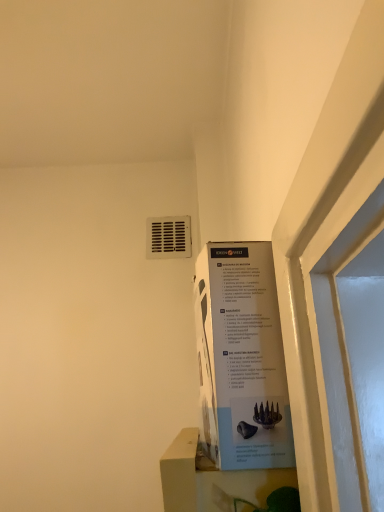
This screenshot has width=384, height=512. Describe the element at coordinates (212, 479) in the screenshot. I see `white matte window sill at lower center` at that location.

Describe the element at coordinates (242, 358) in the screenshot. I see `white cardboard poster at upper right` at that location.

You are a GUI agent. You are given a task and a screenshot of the screen. Output one action in this format:
    pyautogui.click(x=<x>, y=<y>)
    Task: Click on the white matte window sill at lower center
    Image resolution: width=384 pixels, height=512 pixels.
    Given the screenshot: What is the action you would take?
    pyautogui.click(x=212, y=479)

Which is behind, point (263, 356) or point (151, 246)?

The point (151, 246) is more distant.

Considering the relative sizes of white cardboard poster at upper right and white plastic vent at upper center in the image provided, is white cardboard poster at upper right smaller than white plastic vent at upper center?

No, white cardboard poster at upper right is not smaller than white plastic vent at upper center.

From the image's perspective, does white cardboard poster at upper right appear lower than white plastic vent at upper center?

Indeed, from the image's perspective, white cardboard poster at upper right is shown beneath white plastic vent at upper center.

Is white cardboard poster at upper right positioned with its back to white plastic vent at upper center?

That's not correct — white cardboard poster at upper right is not looking away from white plastic vent at upper center.

Can you confirm if white matte window sill at lower center is taller than white plastic vent at upper center?

Indeed, white matte window sill at lower center has a greater height compared to white plastic vent at upper center.

The height and width of the screenshot is (512, 384). In order to click on window sill in front of the white plastic vent at upper center in this screenshot , I will do `click(212, 479)`.

Which is in front, white matte window sill at lower center or white plastic vent at upper center?

white matte window sill at lower center.

Would you say white cardboard poster at upper right is inside or outside white matte window sill at lower center?

white cardboard poster at upper right cannot be found inside white matte window sill at lower center.

Could you tell me if white cardboard poster at upper right is facing white matte window sill at lower center?

Result: No, white cardboard poster at upper right is not aimed at white matte window sill at lower center.

From the picture: Looking at their sizes, would you say white cardboard poster at upper right is wider or thinner than white matte window sill at lower center?

white cardboard poster at upper right is thinner than white matte window sill at lower center.

This screenshot has height=512, width=384. What are the coordinates of `window sill in front of the white cardboard poster at upper right` in the screenshot? It's located at (212, 479).

How many degrees apart are the facing directions of white plastic vent at upper center and white matte window sill at lower center?

91.3 degrees.

In terms of size, does white plastic vent at upper center appear bigger or smaller than white matte window sill at lower center?

white plastic vent at upper center is smaller than white matte window sill at lower center.

Is white plastic vent at upper center located outside white matte window sill at lower center?

Indeed, white plastic vent at upper center is completely outside white matte window sill at lower center.

From a real-world perspective, is white plastic vent at upper center located higher than white cardboard poster at upper right?

Yes, from a real-world perspective, white plastic vent at upper center is over white cardboard poster at upper right

Considering the positions of objects white plastic vent at upper center and white cardboard poster at upper right in the image provided, who is more to the right, white plastic vent at upper center or white cardboard poster at upper right?

white cardboard poster at upper right.

Does white plastic vent at upper center have a greater height compared to white cardboard poster at upper right?

No.

Is white plastic vent at upper center further to camera compared to white cardboard poster at upper right?

Yes, white plastic vent at upper center is further from the camera.

Based on the photo, is white cardboard poster at upper right completely or partially inside white matte window sill at lower center?

No.

From their relative heights in the image, would you say white matte window sill at lower center is taller or shorter than white cardboard poster at upper right?

white matte window sill at lower center is shorter than white cardboard poster at upper right.

Is white matte window sill at lower center oriented away from white cardboard poster at upper right?

No, white matte window sill at lower center is not facing the opposite direction of white cardboard poster at upper right.

From the image's perspective, who appears lower, white matte window sill at lower center or white cardboard poster at upper right?

white matte window sill at lower center, from the image's perspective.

At what (x,y) coordinates should I click in order to perform the action: click on poster located on the right of white plastic vent at upper center. Please return your answer as a coordinate pair (x, y). Looking at the image, I should click on (242, 358).

Identify the location of window sill below the white plastic vent at upper center (from the image's perspective). This screenshot has width=384, height=512. (212, 479).

Based on their spatial positions, is white matte window sill at lower center or white plastic vent at upper center closer to white cardboard poster at upper right?

Based on the image, white matte window sill at lower center appears to be nearer to white cardboard poster at upper right.

Consider the image. Based on their spatial positions, is white cardboard poster at upper right or white plastic vent at upper center closer to white matte window sill at lower center?

white cardboard poster at upper right lies closer to white matte window sill at lower center than the other object.

Consider the image. Considering their positions, is white plastic vent at upper center positioned closer to white matte window sill at lower center than white cardboard poster at upper right?

Among the two, white cardboard poster at upper right is located nearer to white matte window sill at lower center.

In the scene shown: Looking at the image, which one is located further to white plastic vent at upper center, white matte window sill at lower center or white cardboard poster at upper right?

white matte window sill at lower center is further to white plastic vent at upper center.

Considering their positions, is white plastic vent at upper center positioned closer to white cardboard poster at upper right than white matte window sill at lower center?

Among the two, white matte window sill at lower center is located nearer to white cardboard poster at upper right.

From the image, which object appears to be farther from white plastic vent at upper center, white cardboard poster at upper right or white matte window sill at lower center?

white matte window sill at lower center is further to white plastic vent at upper center.

Where is `poster located between white matte window sill at lower center and white plastic vent at upper center in the depth direction`? Image resolution: width=384 pixels, height=512 pixels. poster located between white matte window sill at lower center and white plastic vent at upper center in the depth direction is located at coordinates (242, 358).